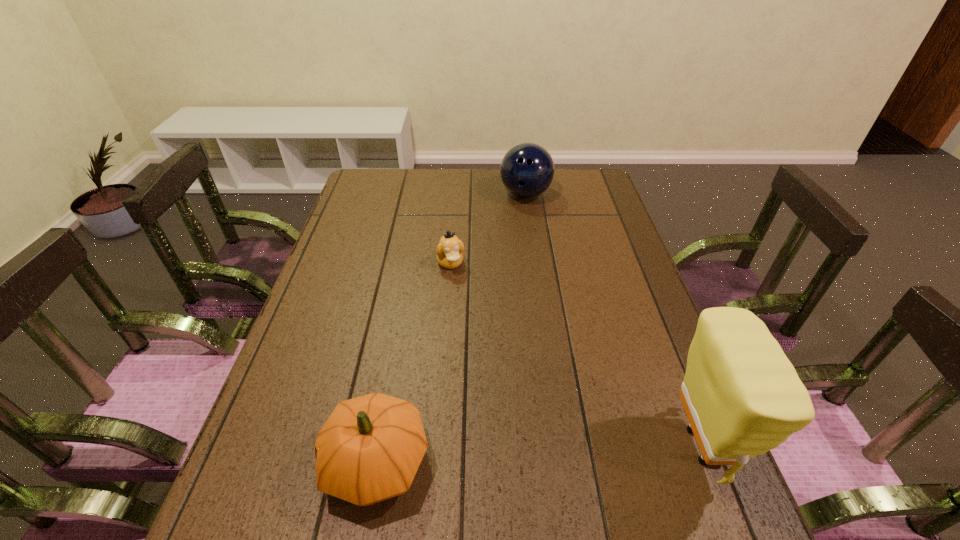
Image resolution: width=960 pixels, height=540 pixels. What are the coordinates of `object at the right edge` in the screenshot? It's located at (742, 396).

Locate an element on the screen. The image size is (960, 540). object located in the near left corner section of the desktop is located at coordinates (370, 448).

At what (x,y) coordinates should I click in order to perform the action: click on object located in the near right corner section of the desktop. Please return your answer as a coordinate pair (x, y). Looking at the image, I should click on (742, 396).

At what (x,y) coordinates should I click in order to perform the action: click on vacant space at the far edge of the desktop. Please return your answer as a coordinate pair (x, y). Looking at the image, I should click on (523, 200).

You are a GUI agent. You are given a task and a screenshot of the screen. Output one action in this format:
    pyautogui.click(x=<x>, y=<y>)
    Task: Click on the free region at the left edge of the desktop
    The image size is (960, 540).
    Given the screenshot: What is the action you would take?
    pyautogui.click(x=307, y=308)

The image size is (960, 540). In the image, there is a desktop. In order to click on free space at the right edge in this screenshot , I will do `click(651, 342)`.

Locate an element on the screen. free region at the far right corner of the desktop is located at coordinates (592, 182).

I want to click on free space at the near right corner, so click(x=696, y=457).

The height and width of the screenshot is (540, 960). I want to click on free spot between the farthest object and the gourd, so [451, 328].

Where is `free space between the tallest object and the second object from right to left`? free space between the tallest object and the second object from right to left is located at coordinates (613, 320).